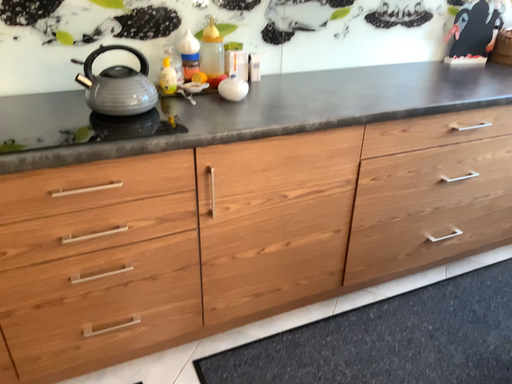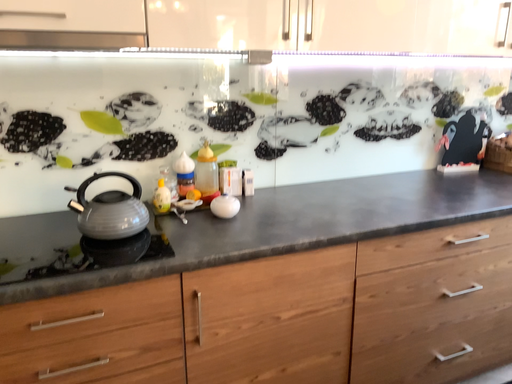
Question: Which way did the camera rotate in the video?

Choices:
 (A) rotated downward
 (B) rotated upward

Answer: (B)